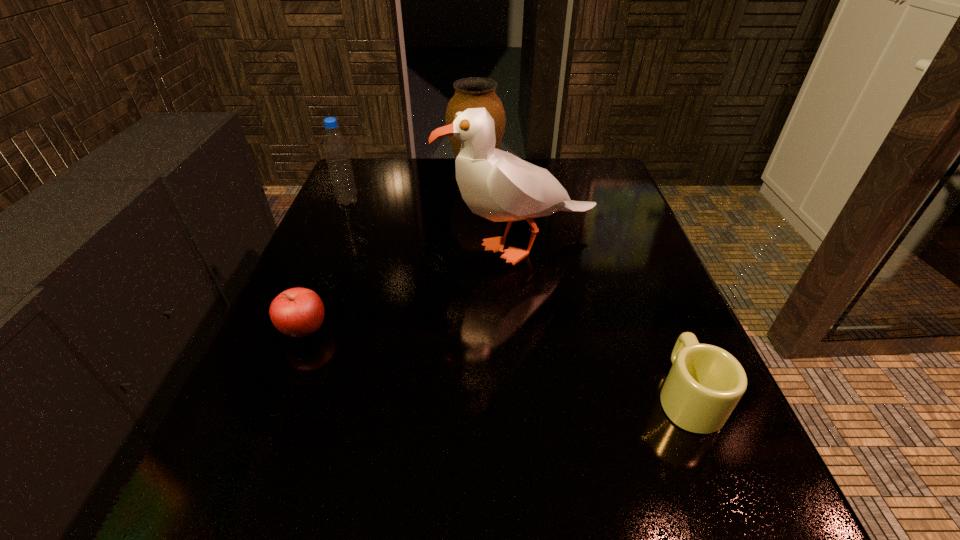
Where is `vacant area that lies between the second nearest object and the mug`? vacant area that lies between the second nearest object and the mug is located at coordinates (495, 363).

You are a GUI agent. You are given a task and a screenshot of the screen. Output one action in this format:
    pyautogui.click(x=<x>, y=<y>)
    Task: Click on the vacant space that's between the nearest object and the apple
    
    Given the screenshot: What is the action you would take?
    pyautogui.click(x=495, y=363)

Locate an element on the screen. free space between the water bottle and the rightmost object is located at coordinates (517, 299).

In order to click on free space between the second nearest object and the nearest object in this screenshot , I will do tap(495, 363).

You are a GUI agent. You are given a task and a screenshot of the screen. Output one action in this format:
    pyautogui.click(x=<x>, y=<y>)
    Task: Click on the vacant space that's between the gull and the rightmost object
    This screenshot has height=540, width=960.
    Given the screenshot: What is the action you would take?
    pyautogui.click(x=604, y=321)

The image size is (960, 540). What are the coordinates of `vacant point located between the nearest object and the third nearest object` in the screenshot? It's located at (604, 321).

Image resolution: width=960 pixels, height=540 pixels. I want to click on vacant area that lies between the fourth nearest object and the farthest object, so click(x=412, y=188).

Image resolution: width=960 pixels, height=540 pixels. I want to click on vacant area that lies between the second farthest object and the tallest object, so click(x=434, y=225).

The image size is (960, 540). In order to click on object that is the fourth closest to the second farthest object in this screenshot , I will do `click(705, 383)`.

Select which object is the third closest to the second nearest object. Please provide its 2D coordinates. Your answer should be formatted as a tuple, i.e. [(x, y)], where the tuple contains the x and y coordinates of a point satisfying the conditions above.

[(474, 92)]